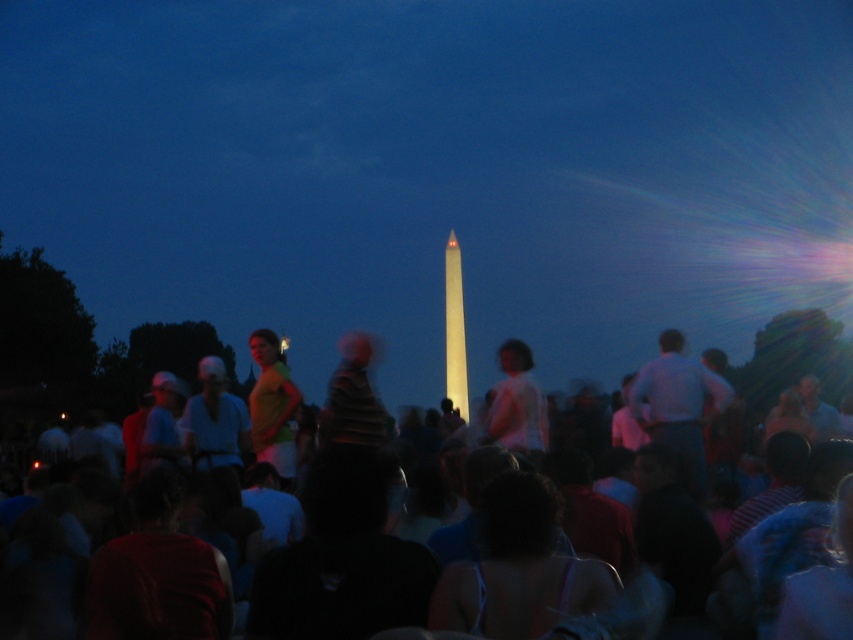
Which is more to the right, white marble monument at center or white polished stone obelisk at center?

white polished stone obelisk at center is more to the right.

Based on the photo, is white marble monument at center above white polished stone obelisk at center?

Indeed, white marble monument at center is positioned over white polished stone obelisk at center.

Between point (784, 20) and point (459, 285), which one is positioned behind?

Positioned behind is point (784, 20).

I want to click on white marble monument at center, so click(x=436, y=172).

Which is in front, point (502, 404) or point (456, 404)?

Positioned in front is point (502, 404).

Does white matte shirt at center have a greater height compared to white polished stone obelisk at center?

No, white matte shirt at center is not taller than white polished stone obelisk at center.

Between point (494, 404) and point (459, 374), which one is positioned in front?

Point (494, 404) is in front.

At what (x,y) coordinates should I click in order to perform the action: click on white matte shirt at center. Please return your answer as a coordinate pair (x, y). Looking at the image, I should click on (517, 403).

Who is positioned more to the left, black cotton crowd at center or yellow fabric shirt at center?

Positioned to the left is yellow fabric shirt at center.

Which of these two, black cotton crowd at center or yellow fabric shirt at center, stands shorter?

Standing shorter between the two is yellow fabric shirt at center.

Is point (148, 600) positioned behind point (283, 436)?

No, it is in front of (283, 436).

The image size is (853, 640). I want to click on black cotton crowd at center, so click(x=363, y=506).